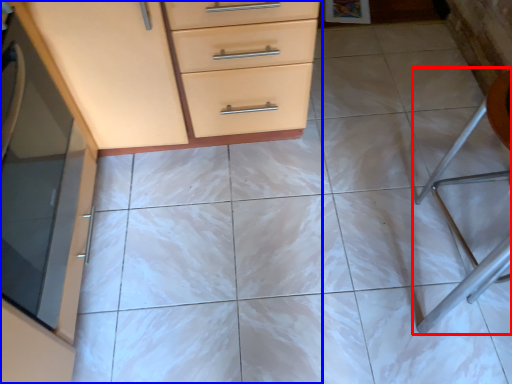
Question: Which object is further to the camera taking this photo, folding chair (highlighted by a red box) or chest of drawers (highlighted by a blue box)?

Choices:
 (A) folding chair
 (B) chest of drawers

Answer: (A)